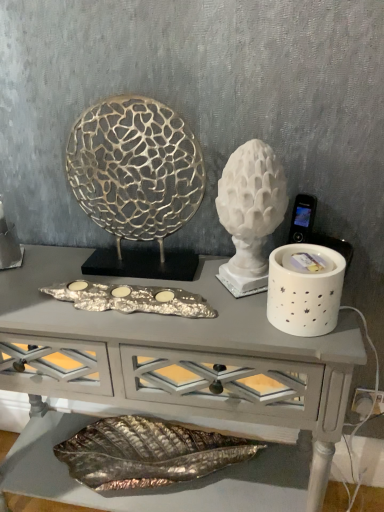
Question: From the image's perspective, does gold textured sculpture at center, the 1th sculpture from the left, appear higher than silver metallic tray at center?

Choices:
 (A) yes
 (B) no

Answer: (A)

Question: Considering the relative sizes of gold textured sculpture at center, the second sculpture viewed from the right, and silver metallic tray at center in the image provided, is gold textured sculpture at center, the second sculpture viewed from the right, taller than silver metallic tray at center?

Choices:
 (A) no
 (B) yes

Answer: (B)

Question: From the image's perspective, is gold textured sculpture at center, the 1th sculpture from the left, under silver metallic tray at center?

Choices:
 (A) no
 (B) yes

Answer: (A)

Question: Is gold textured sculpture at center, the 1th sculpture from the left, completely or partially outside of silver metallic tray at center?

Choices:
 (A) no
 (B) yes

Answer: (B)

Question: From a real-world perspective, is gold textured sculpture at center, the second sculpture viewed from the right, on silver metallic tray at center?

Choices:
 (A) no
 (B) yes

Answer: (B)

Question: Considering the relative positions of white ceramic candle holder at right and silver metallic tray at center in the image provided, is white ceramic candle holder at right to the left or to the right of silver metallic tray at center?

Choices:
 (A) left
 (B) right

Answer: (B)

Question: Choose the correct answer: Is white ceramic candle holder at right inside silver metallic tray at center or outside it?

Choices:
 (A) inside
 (B) outside

Answer: (B)

Question: Considering their positions, is white ceramic candle holder at right located in front of or behind silver metallic tray at center?

Choices:
 (A) behind
 (B) front

Answer: (B)

Question: Looking at their shapes, would you say white ceramic candle holder at right is wider or thinner than silver metallic tray at center?

Choices:
 (A) thin
 (B) wide

Answer: (B)

Question: Does point (109, 178) appear closer or farther from the camera than point (299, 313)?

Choices:
 (A) closer
 (B) farther

Answer: (B)

Question: Do you think gold textured sculpture at center, the 1th sculpture from the left, is within white ceramic candle holder at right, or outside of it?

Choices:
 (A) outside
 (B) inside

Answer: (A)

Question: Is gold textured sculpture at center, the second sculpture viewed from the right, to the left or to the right of white ceramic candle holder at right in the image?

Choices:
 (A) right
 (B) left

Answer: (B)

Question: From a real-world perspective, relative to white ceramic candle holder at right, is gold textured sculpture at center, the second sculpture viewed from the right, vertically above or below?

Choices:
 (A) above
 (B) below

Answer: (A)

Question: From a real-world perspective, is white marble sculpture at center, which is the second sculpture from left to right, above or below silver metallic tray at center?

Choices:
 (A) below
 (B) above

Answer: (B)

Question: From the image's perspective, is white marble sculpture at center, which appears as the first sculpture when viewed from the right, above or below silver metallic tray at center?

Choices:
 (A) above
 (B) below

Answer: (A)